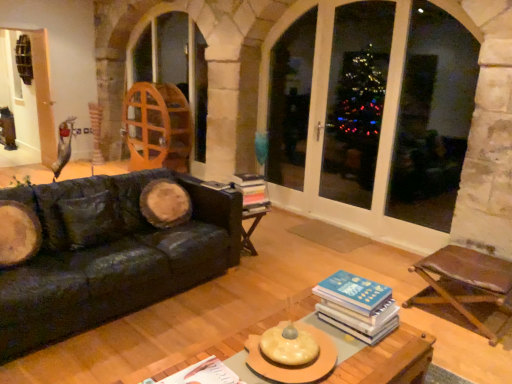
Question: Can you confirm if blue hardcover book at center, which is counted as the 2th book, starting from the back, is thinner than hardcover books at center, which is the second book from left to right?

Choices:
 (A) no
 (B) yes

Answer: (A)

Question: Is blue hardcover book at center, acting as the second book starting from the front, closer to the viewer compared to hardcover books at center, positioned as the 3th book in front-to-back order?

Choices:
 (A) yes
 (B) no

Answer: (A)

Question: Is blue hardcover book at center, acting as the second book starting from the front, outside hardcover books at center, positioned as the 3th book in front-to-back order?

Choices:
 (A) no
 (B) yes

Answer: (B)

Question: Is blue hardcover book at center, the 2th book ordered from the bottom, turned away from hardcover books at center, the first book in the back-to-front sequence?

Choices:
 (A) yes
 (B) no

Answer: (B)

Question: From the image's perspective, is blue hardcover book at center, which is counted as the 2th book, starting from the back, below hardcover books at center, the first book in the back-to-front sequence?

Choices:
 (A) yes
 (B) no

Answer: (A)

Question: Is blue hardcover book at center, the 1th book viewed from the right, in contact with hardcover books at center, placed as the 2th book when sorted from right to left?

Choices:
 (A) no
 (B) yes

Answer: (A)

Question: Is blue hardcover book at center, acting as the second book starting from the front, outside wooden coffee table at center?

Choices:
 (A) yes
 (B) no

Answer: (A)

Question: Considering the relative positions of blue hardcover book at center, the 1th book viewed from the right, and wooden coffee table at center in the image provided, is blue hardcover book at center, the 1th book viewed from the right, to the right of wooden coffee table at center from the viewer's perspective?

Choices:
 (A) yes
 (B) no

Answer: (A)

Question: Can you confirm if blue hardcover book at center, which is counted as the 2th book, starting from the back, is taller than wooden coffee table at center?

Choices:
 (A) yes
 (B) no

Answer: (B)

Question: Considering the relative sizes of blue hardcover book at center, the 3th book when ordered from left to right, and wooden coffee table at center in the image provided, is blue hardcover book at center, the 3th book when ordered from left to right, wider than wooden coffee table at center?

Choices:
 (A) yes
 (B) no

Answer: (B)

Question: Does blue hardcover book at center, the 1th book viewed from the right, turn towards wooden coffee table at center?

Choices:
 (A) no
 (B) yes

Answer: (A)

Question: Does blue hardcover book at center, the 1th book viewed from the right, contain wooden coffee table at center?

Choices:
 (A) no
 (B) yes

Answer: (A)

Question: Considering the relative sizes of black leather couch at left and brown leather chair at lower right in the image provided, is black leather couch at left smaller than brown leather chair at lower right?

Choices:
 (A) yes
 (B) no

Answer: (B)